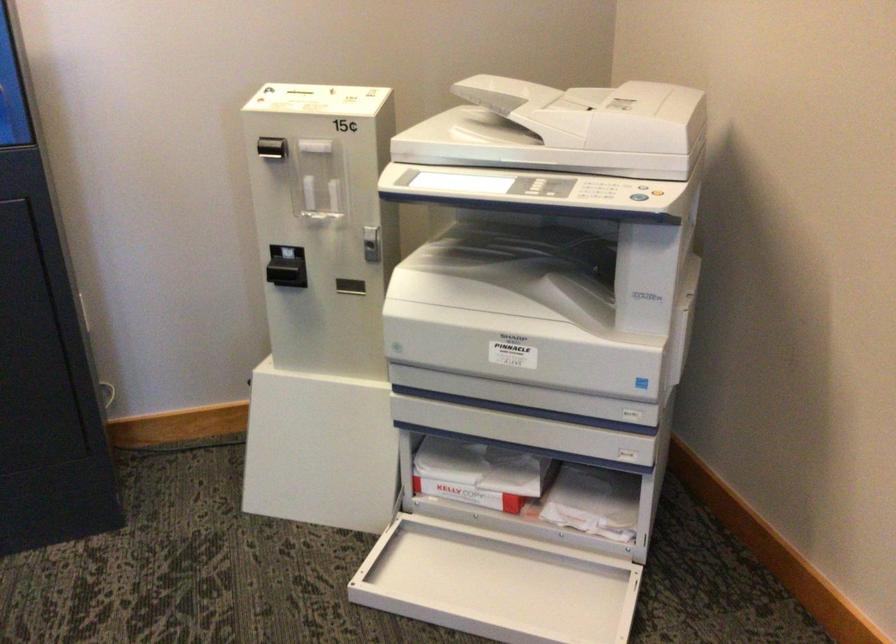
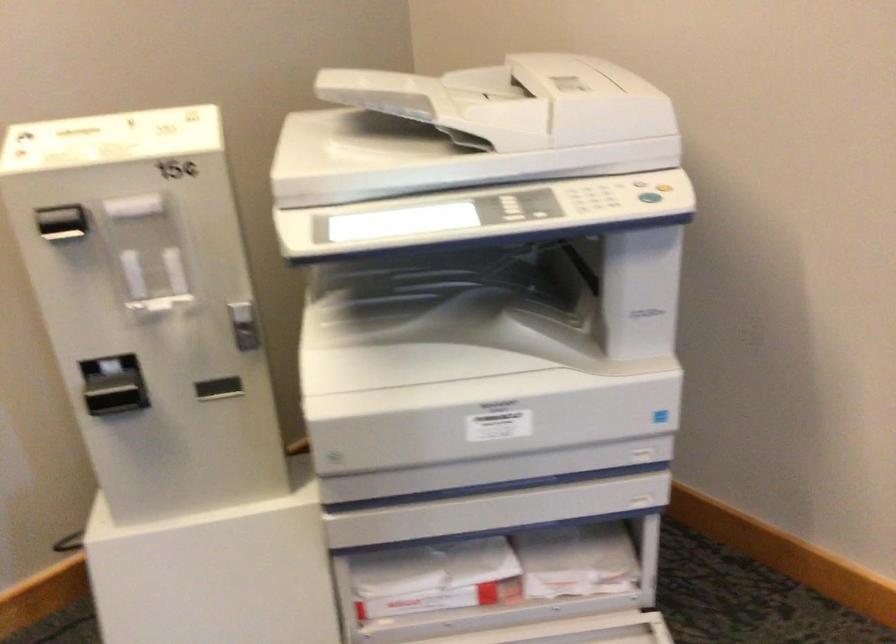
Where in the second image is the point corresponding to pixel 656 192 from the first image?

(664, 185)